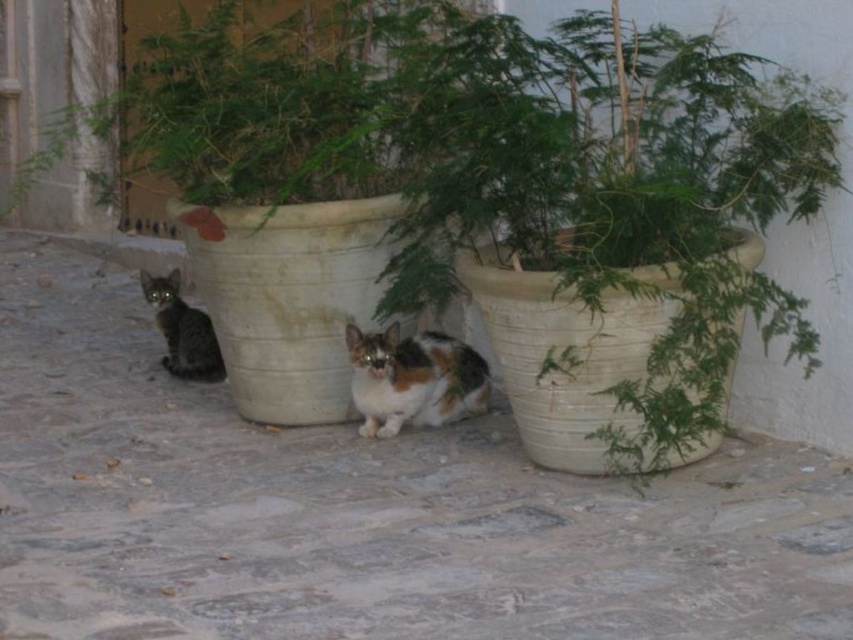
You are a photographer trying to capture both cats in a single frame. Given the calico fur cat at center and the striped fur cat at lower left, which cat requires more space to fully fit into the photo without cropping?

The calico fur cat at center requires more space because its width surpasses that of the striped fur cat at lower left.

You are standing in the courtyard looking at the two cats. Which of the two points, point (460, 385) or point (187, 314), is closer to you?

Point (460, 385) is closer to the camera than point (187, 314), so the point (460, 385) is closer to you.